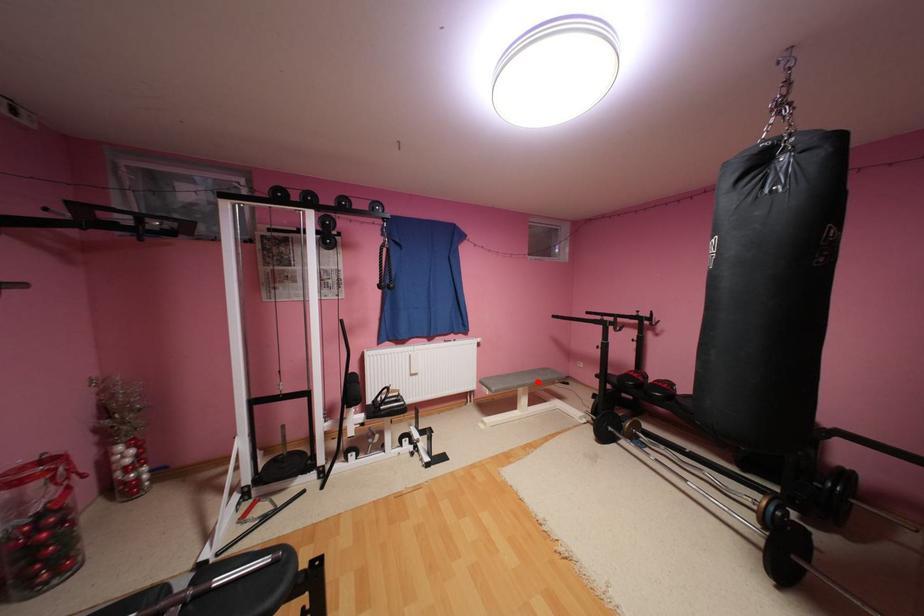
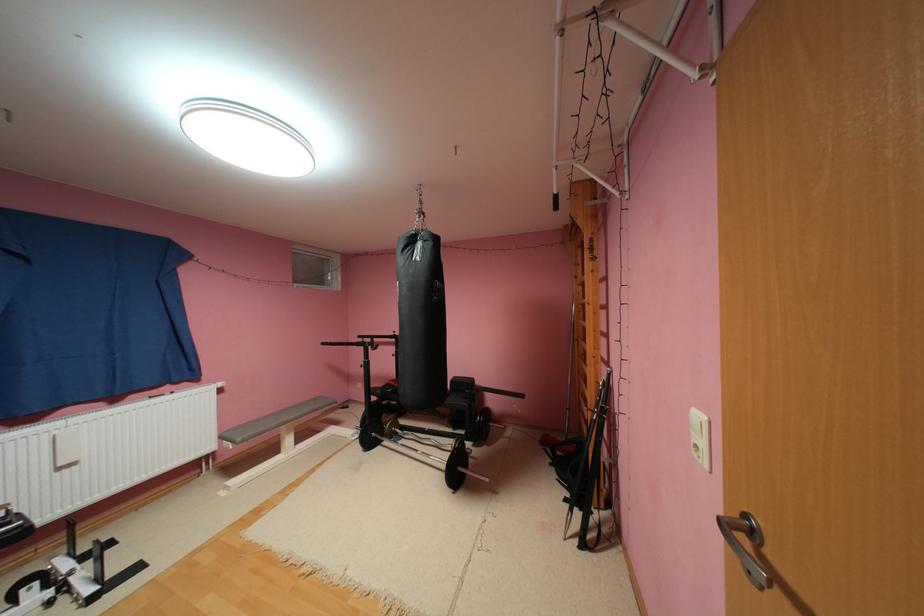
The point at the highlighted location is marked in the first image. Where is the corresponding point in the second image?

(300, 416)